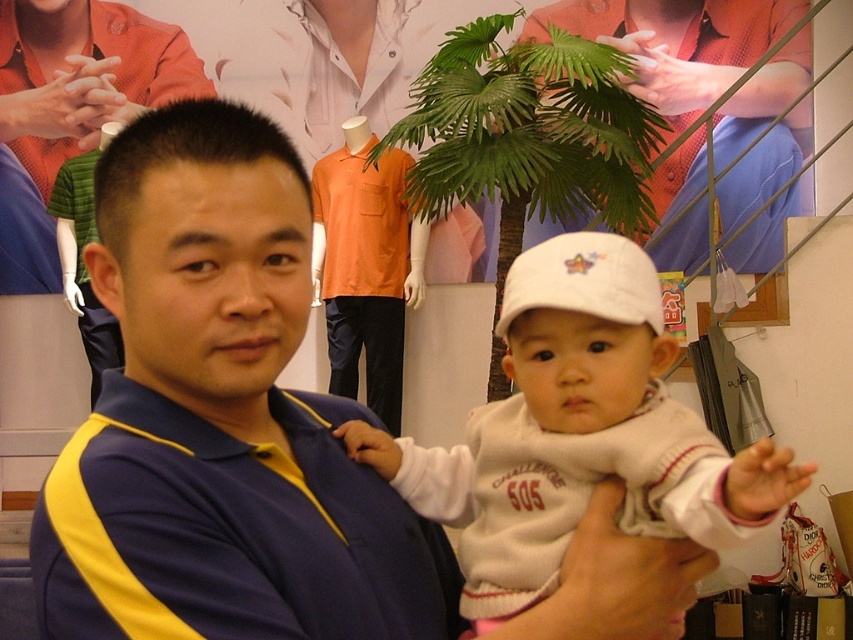
Question: Does white fleece sweater at center have a lesser width compared to green leafy plant at upper center?

Choices:
 (A) no
 (B) yes

Answer: (B)

Question: Is blue/yellow polo shirt at center positioned at the back of white fleece sweater at center?

Choices:
 (A) no
 (B) yes

Answer: (B)

Question: Is white fleece sweater at center wider than green leafy plant at upper center?

Choices:
 (A) yes
 (B) no

Answer: (B)

Question: Which point is farther to the camera?

Choices:
 (A) blue/yellow polo shirt at center
 (B) white fleece sweater at center

Answer: (A)

Question: Which object is closer to the camera taking this photo?

Choices:
 (A) white fleece sweater at center
 (B) green leafy plant at upper center
 (C) blue/yellow polo shirt at center

Answer: (A)

Question: Considering the real-world distances, which object is farthest from the green leafy plant at upper center?

Choices:
 (A) blue/yellow polo shirt at center
 (B) white fleece sweater at center

Answer: (A)